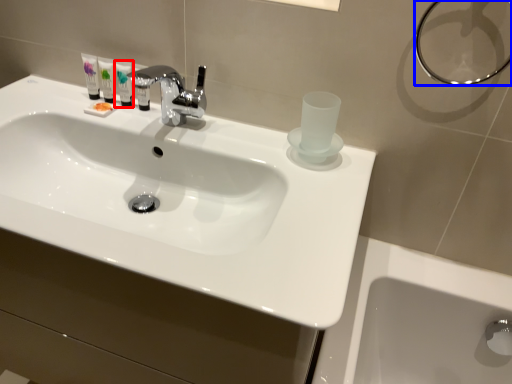
Question: Among these objects, which one is nearest to the camera, mouthwash (highlighted by a red box) or shower (highlighted by a blue box)?

Choices:
 (A) mouthwash
 (B) shower

Answer: (B)